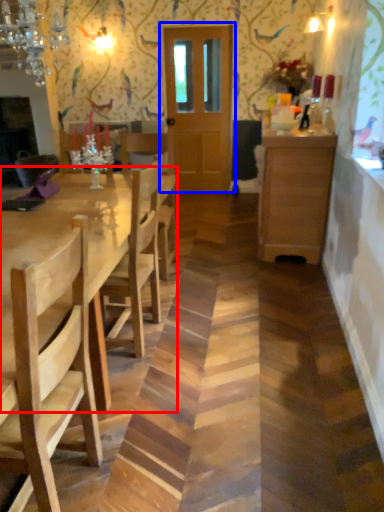
Question: Which object appears closest to the camera in this image, kitchen & dining room table (highlighted by a red box) or door (highlighted by a blue box)?

Choices:
 (A) kitchen & dining room table
 (B) door

Answer: (A)